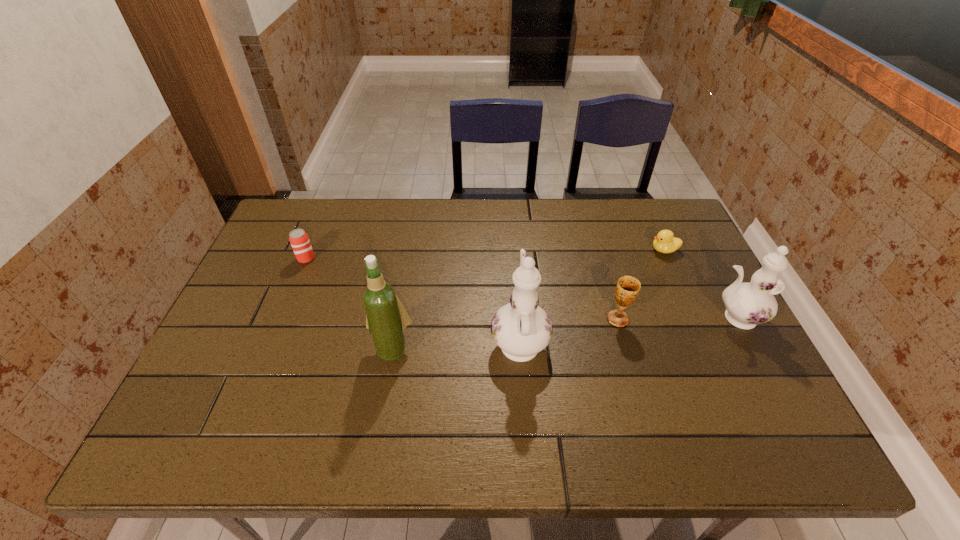
In the image, there is a desktop. What are the coordinates of `vacant space at the right edge` in the screenshot? It's located at (670, 303).

Find the location of a particular element. The height and width of the screenshot is (540, 960). vacant space at the far right corner is located at coordinates (636, 225).

Identify the location of free location at the near right corner of the desktop. (779, 403).

Identify the location of free area in between the fifth tallest object and the shortest object. (485, 254).

Find the location of a particular element. empty space that is in between the shorter chinaware and the fifth object from right to left is located at coordinates (564, 333).

The height and width of the screenshot is (540, 960). I want to click on vacant area between the left chinaware and the third tallest object, so click(x=627, y=329).

I want to click on free area in between the fifth tallest object and the fourth object from left to right, so click(x=462, y=289).

Where is `vacant space that's between the shortest object and the shorter chinaware`? This screenshot has height=540, width=960. vacant space that's between the shortest object and the shorter chinaware is located at coordinates (699, 284).

At what (x,y) coordinates should I click in order to perform the action: click on object that can be found as the fourth closest to the shortest object. Please return your answer as a coordinate pair (x, y). This screenshot has width=960, height=540. Looking at the image, I should click on (386, 318).

Locate which object is the second closest to the shortest object. Please provide its 2D coordinates. Your answer should be formatted as a tuple, i.e. [(x, y)], where the tuple contains the x and y coordinates of a point satisfying the conditions above.

[(628, 287)]